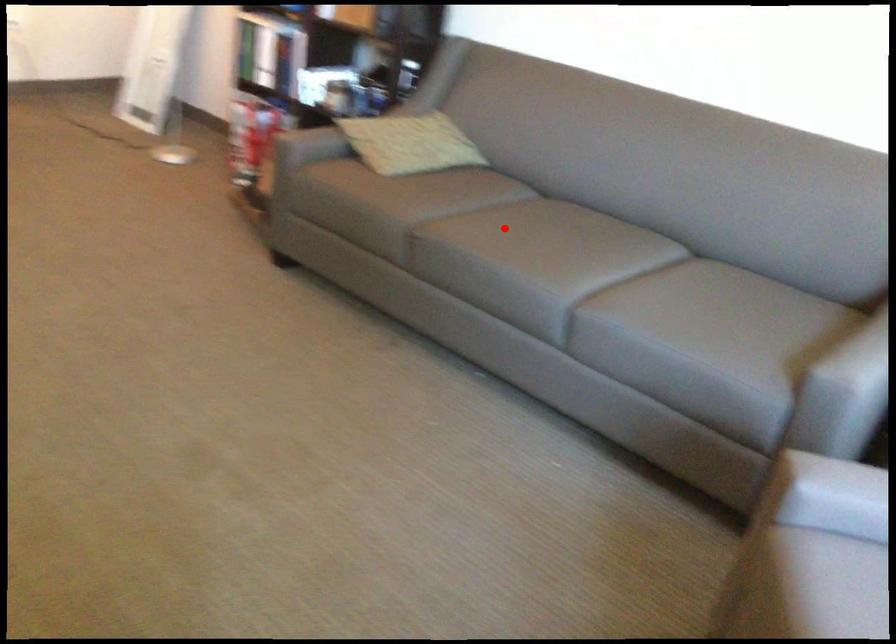
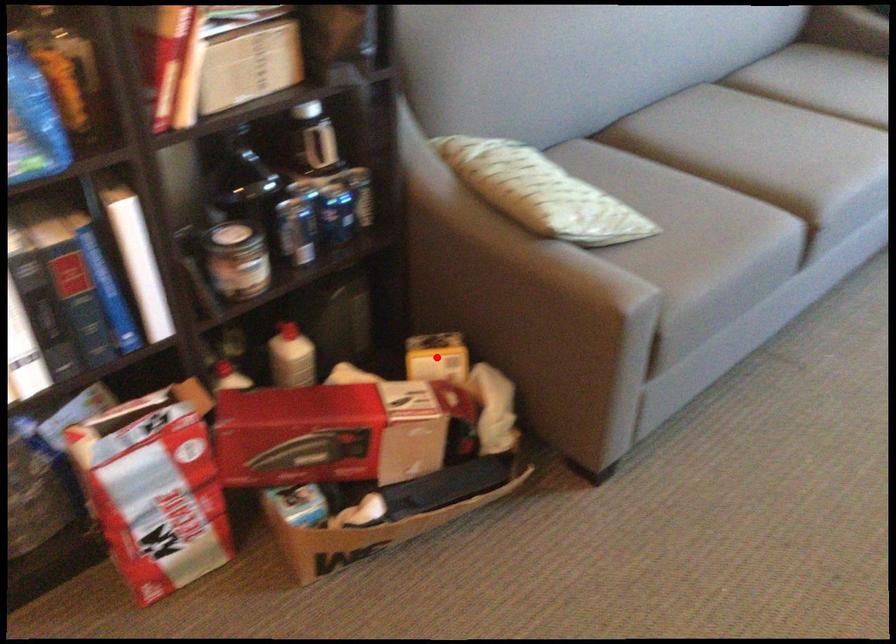
I am providing you with two images of the same scene from different viewpoints. A red point is marked on the first image and another point is marked on the second image. Do the highlighted points in image1 and image2 indicate the same real-world spot?

No